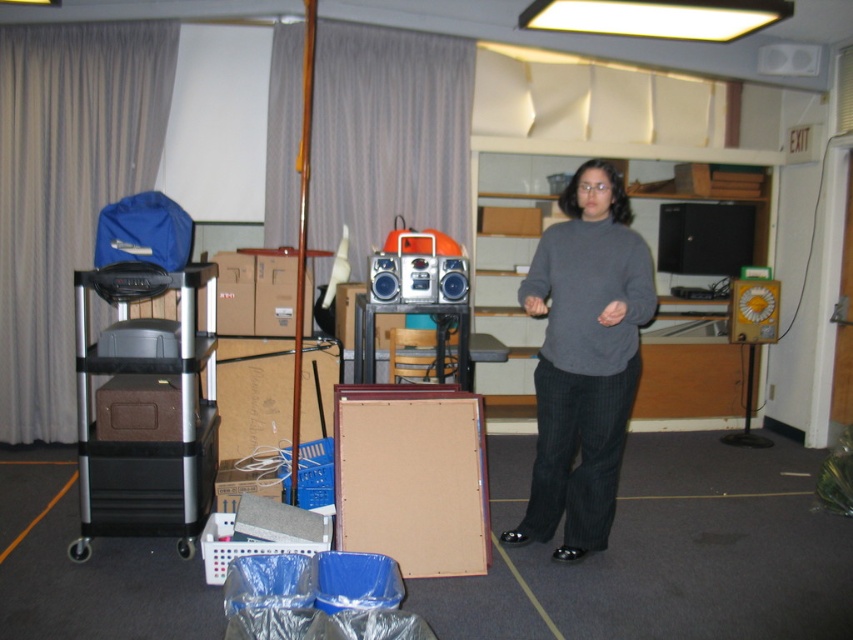
Is gray sweater at center wider than metallic silver cart at left?

Incorrect, gray sweater at center's width does not surpass metallic silver cart at left's.

The height and width of the screenshot is (640, 853). What are the coordinates of `gray sweater at center` in the screenshot? It's located at (584, 358).

Who is more distant from viewer, (650, 289) or (100, 522)?

Point (100, 522)

Identify the location of gray sweater at center. The image size is (853, 640). (584, 358).

You are a GUI agent. You are given a task and a screenshot of the screen. Output one action in this format:
    pyautogui.click(x=<x>, y=<y>)
    Task: Click on the gray sweater at center
    
    Given the screenshot: What is the action you would take?
    click(x=584, y=358)

Which of these two, gray sweater at center or brown cardboard box at center, stands shorter?

With less height is brown cardboard box at center.

At what (x,y) coordinates should I click in order to perform the action: click on gray sweater at center. Please return your answer as a coordinate pair (x, y). Looking at the image, I should click on (584, 358).

Which is below, brown cardboard box at center or shiny silver radio at center?

Positioned lower is brown cardboard box at center.

Which of these two, brown cardboard box at center or shiny silver radio at center, stands shorter?

Standing shorter between the two is shiny silver radio at center.

This screenshot has width=853, height=640. Find the location of `brown cardboard box at center`. brown cardboard box at center is located at coordinates (253, 394).